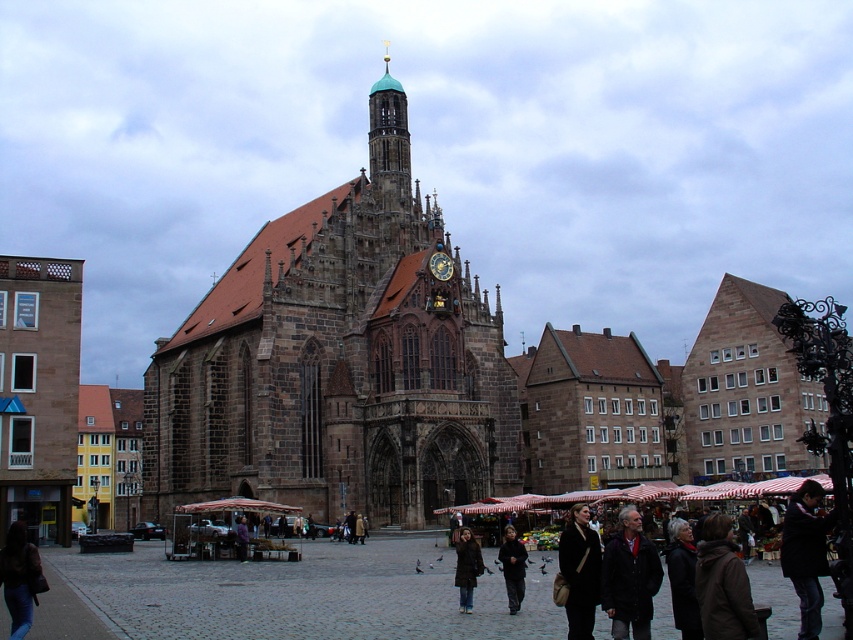
You are a photographer standing in the market square in front of the Gothic church. You notice two people wearing leather outerwear. One is wearing a brown leather jacket at lower right and the other a dark brown leather coat at center. Which person is closer to the photographer?

The brown leather jacket at lower right is positioned over the dark brown leather coat at center, meaning the person wearing the brown leather jacket at lower right is closer to the photographer.